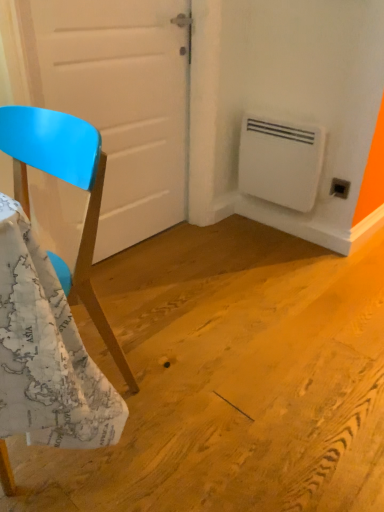
This screenshot has height=512, width=384. I want to click on free location to the right of white matte door at center, so click(x=220, y=261).